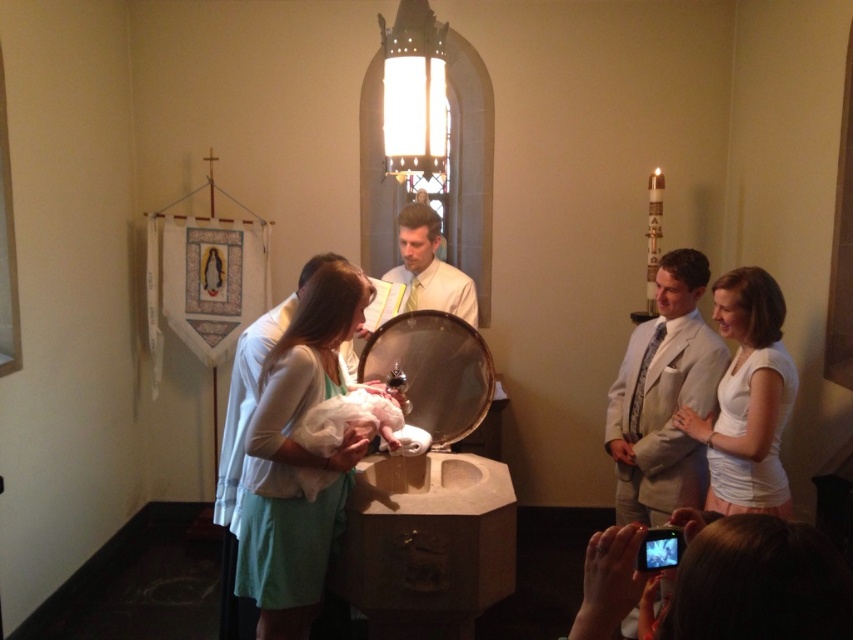
You are a photographer positioned at the back of the church during the baptismal ceremony. You need to capture a clear photo of the white cotton shirt at right and the white textured suit at right. Which one is closer to the camera so that it appears larger in the photo?

The white textured suit at right is closer to the camera than the white cotton shirt at right, so it will appear larger in the photo.